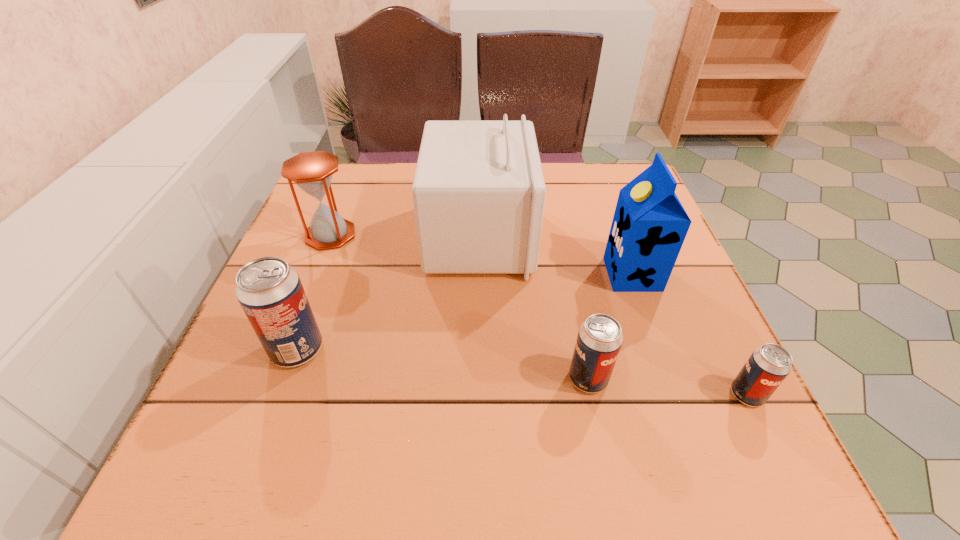
Select which beer can is the closest to the second tallest beer can. Please provide its 2D coordinates. Your answer should be formatted as a tuple, i.e. [(x, y)], where the tuple contains the x and y coordinates of a point satisfying the conditions above.

[(767, 367)]

Identify the location of free point that satisfies the following two spatial constraints: 1. on the back side of the rightmost object; 2. with the cap open on the second object from right to left. Image resolution: width=960 pixels, height=540 pixels. (688, 274).

In order to click on vacant point that satisfies the following two spatial constraints: 1. on the front-facing side of the first-aid kit; 2. on the back side of the second shortest object in this screenshot , I will do `click(479, 379)`.